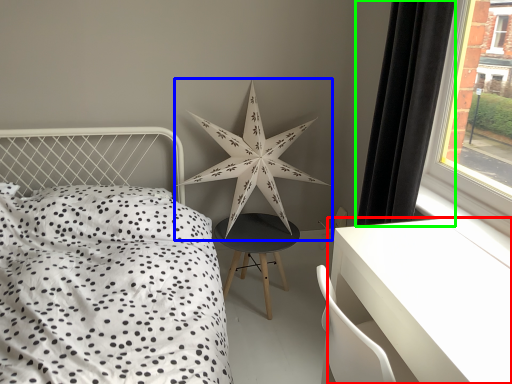
Question: Estimate the real-world distances between objects in this image. Which object is farther from table (highlighted by a red box), star (highlighted by a blue box) or curtain (highlighted by a green box)?

Choices:
 (A) star
 (B) curtain

Answer: (A)